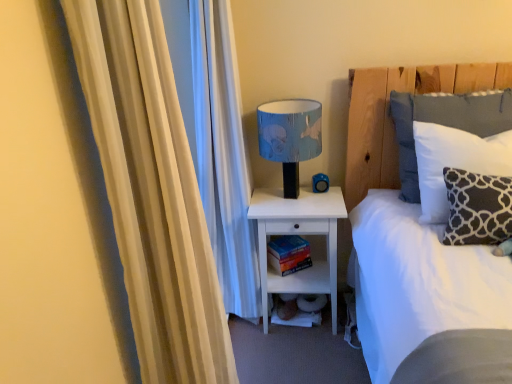
Question: Can you confirm if dark gray fabric pillow at right, which is the 2th pillow from back to front, is thinner than white soft bed at upper right?

Choices:
 (A) yes
 (B) no

Answer: (A)

Question: From a real-world perspective, is dark gray fabric pillow at right, which is the 2th pillow from back to front, beneath white soft bed at upper right?

Choices:
 (A) yes
 (B) no

Answer: (B)

Question: Does dark gray fabric pillow at right, which is the 2th pillow from back to front, touch white soft bed at upper right?

Choices:
 (A) no
 (B) yes

Answer: (A)

Question: Would you say white soft bed at upper right is part of dark gray fabric pillow at right, the 1th pillow viewed from the front,'s contents?

Choices:
 (A) no
 (B) yes

Answer: (A)

Question: Can you confirm if dark gray fabric pillow at right, the 1th pillow viewed from the front, is positioned to the left of white soft bed at upper right?

Choices:
 (A) yes
 (B) no

Answer: (B)

Question: From the image's perspective, is white matte nightstand at lower center above or below hardcover book at lower center?

Choices:
 (A) above
 (B) below

Answer: (B)

Question: Is white matte nightstand at lower center taller or shorter than hardcover book at lower center?

Choices:
 (A) tall
 (B) short

Answer: (A)

Question: Based on their sizes in the image, would you say white matte nightstand at lower center is bigger or smaller than hardcover book at lower center?

Choices:
 (A) small
 (B) big

Answer: (B)

Question: Is white matte nightstand at lower center situated inside hardcover book at lower center or outside?

Choices:
 (A) outside
 (B) inside

Answer: (A)

Question: In terms of height, does hardcover book at lower center look taller or shorter compared to blue fabric lampshade at upper center?

Choices:
 (A) tall
 (B) short

Answer: (B)

Question: Is point (302, 238) closer or farther from the camera than point (284, 193)?

Choices:
 (A) closer
 (B) farther

Answer: (B)

Question: From the image's perspective, is hardcover book at lower center above or below blue fabric lampshade at upper center?

Choices:
 (A) above
 (B) below

Answer: (B)

Question: Relative to blue fabric lampshade at upper center, is hardcover book at lower center in front or behind?

Choices:
 (A) behind
 (B) front

Answer: (A)

Question: Visually, is white cotton pillow at upper right, which is the second pillow from front to back, positioned to the left or to the right of white soft bed at upper right?

Choices:
 (A) left
 (B) right

Answer: (B)

Question: Relative to white soft bed at upper right, is white cotton pillow at upper right, marked as the first pillow in a back-to-front arrangement, in front or behind?

Choices:
 (A) front
 (B) behind

Answer: (B)